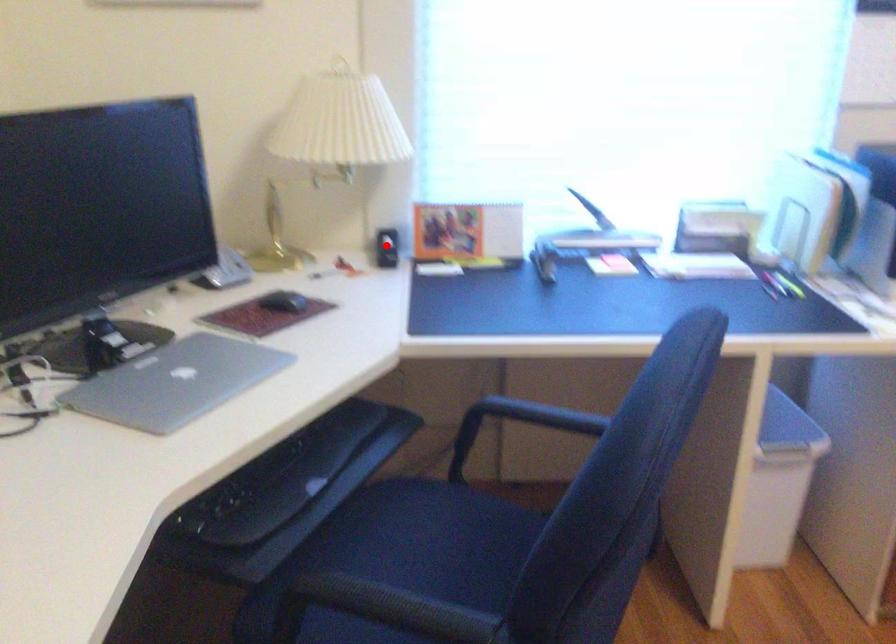
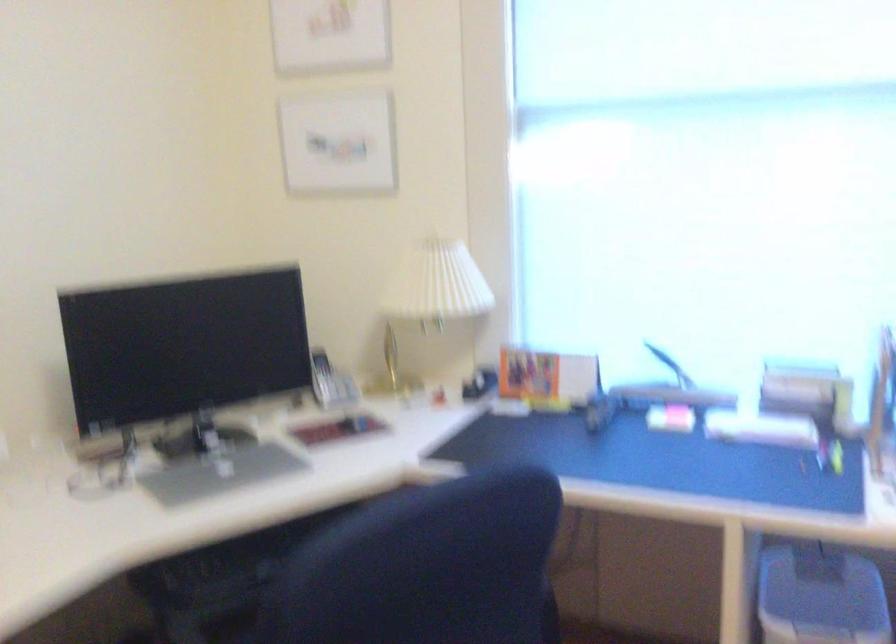
Question: I am providing you with two images of the same scene from different viewpoints. Given a red point in image1, look at the same physical point in image2. Is it:

Choices:
 (A) Closer to the viewpoint
 (B) Farther from the viewpoint

Answer: (B)